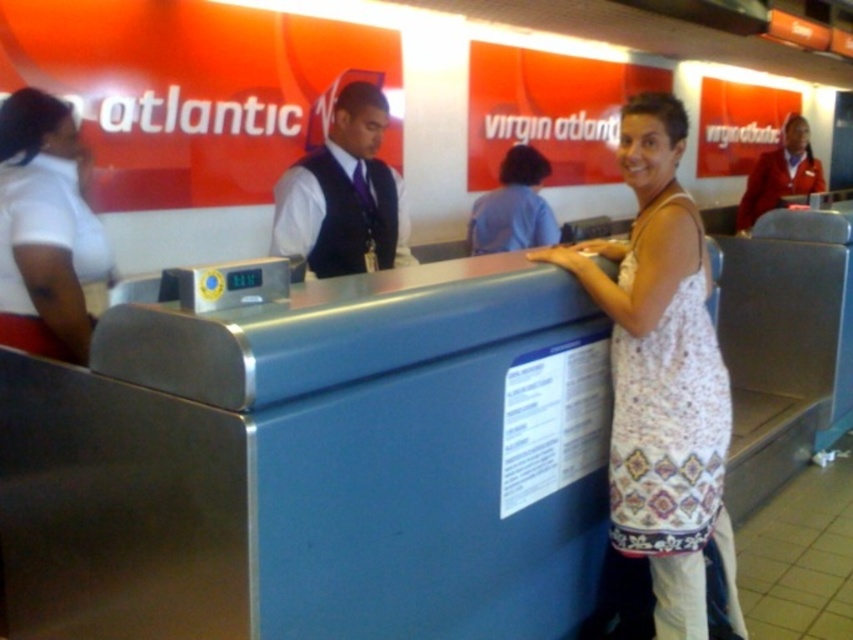
You are a photographer standing at the Virgin Atlantic checkin counter. You need to take a photo of both the white printed dress at center and the white matte shirt at left. Which object should you focus on first if you want to capture both in one frame without moving the camera?

The white printed dress at center is taller than the white matte shirt at left, so you should focus on the white printed dress at center first to ensure both are in frame.